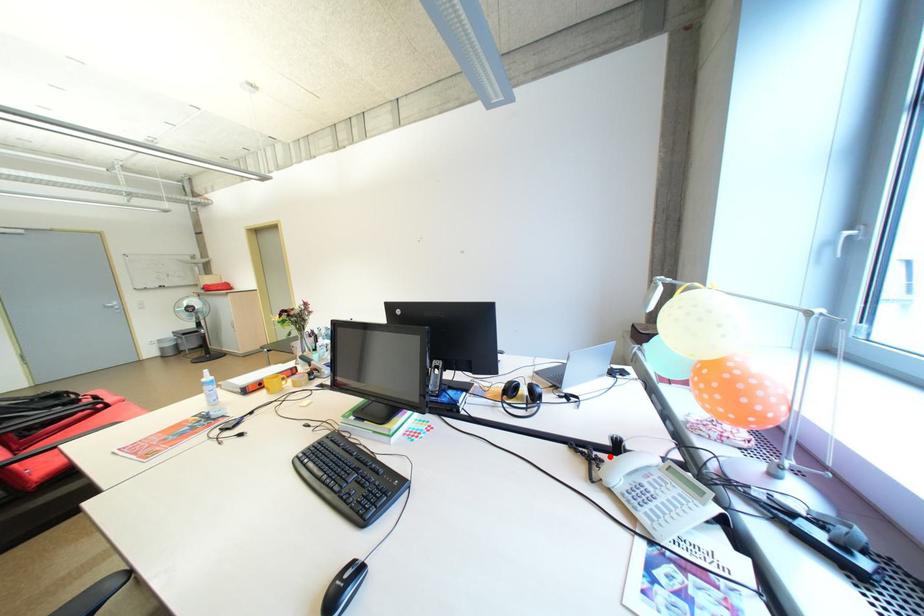
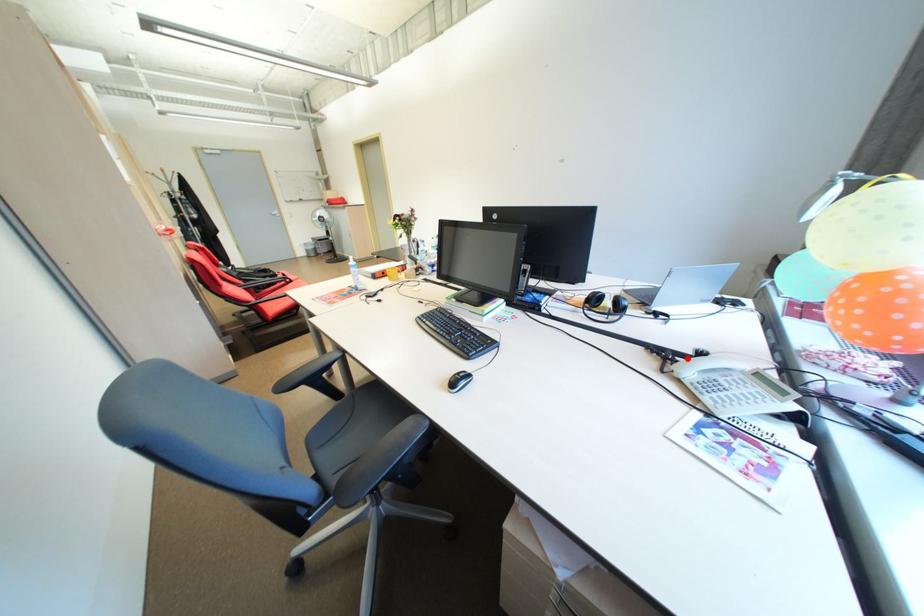
I am providing you with two images of the same scene from different viewpoints. A red point is marked on the first image and another point is marked on the second image. Does the point marked in image1 correspond to the same location as the one in image2?

Yes